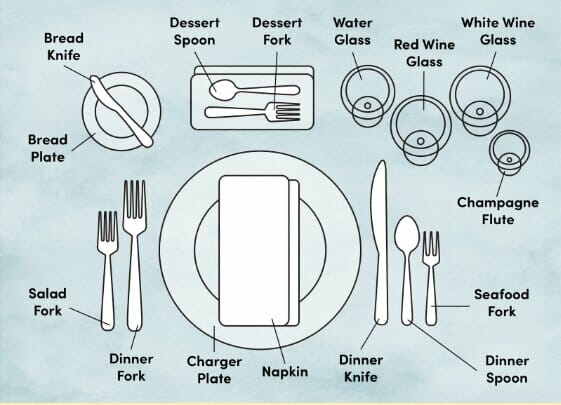
The height and width of the screenshot is (405, 561). I want to click on napkin, so click(269, 231).